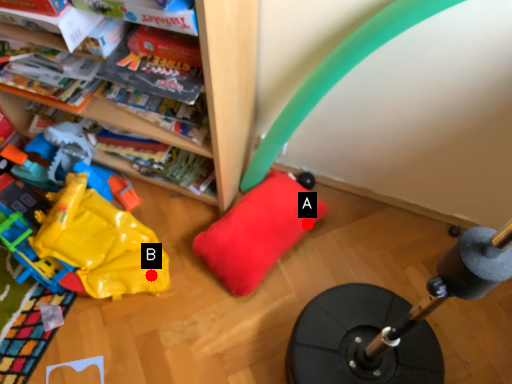
Question: Two points are circled on the image, labeled by A and B beside each circle. Which point is further to the camera?

Choices:
 (A) A is further
 (B) B is further

Answer: (A)